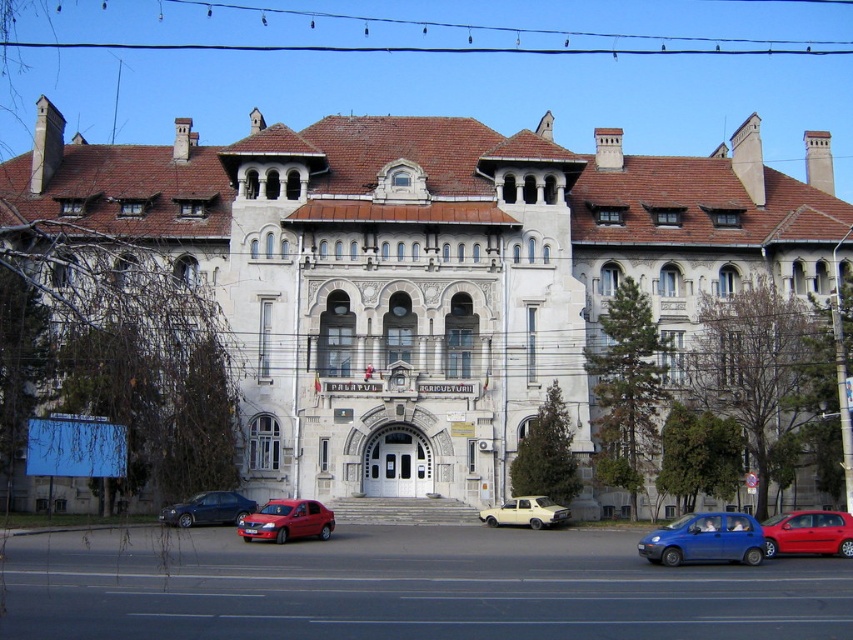
You are a photographer trying to capture both the metallic red car at center and the metallic blue sedan at lower center in a single frame. Which car should you focus on first to ensure the taller one is properly in focus?

You should focus on the metallic red car at center first because it is taller than the metallic blue sedan at lower center, ensuring proper focus on its height.

You are standing in front of the grand building and want to take a photo that includes both the white stone building at center and the blue matte hatchback at lower right. Which object should you position closer to the camera to ensure both are fully visible in the frame?

To ensure both the white stone building at center and the blue matte hatchback at lower right are fully visible in the frame, you should position the blue matte hatchback at lower right closer to the camera. Since the white stone building at center is taller, placing the hatchback nearer will help balance their sizes in the photo.